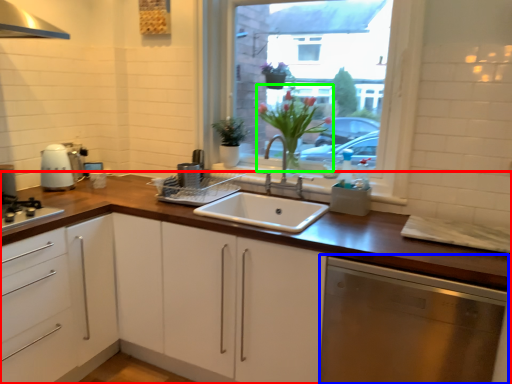
Question: Based on their relative distances, which object is farther from cabinetry (highlighted by a red box)? Choose from dish washer (highlighted by a blue box) and flower (highlighted by a green box).

Choices:
 (A) dish washer
 (B) flower

Answer: (B)